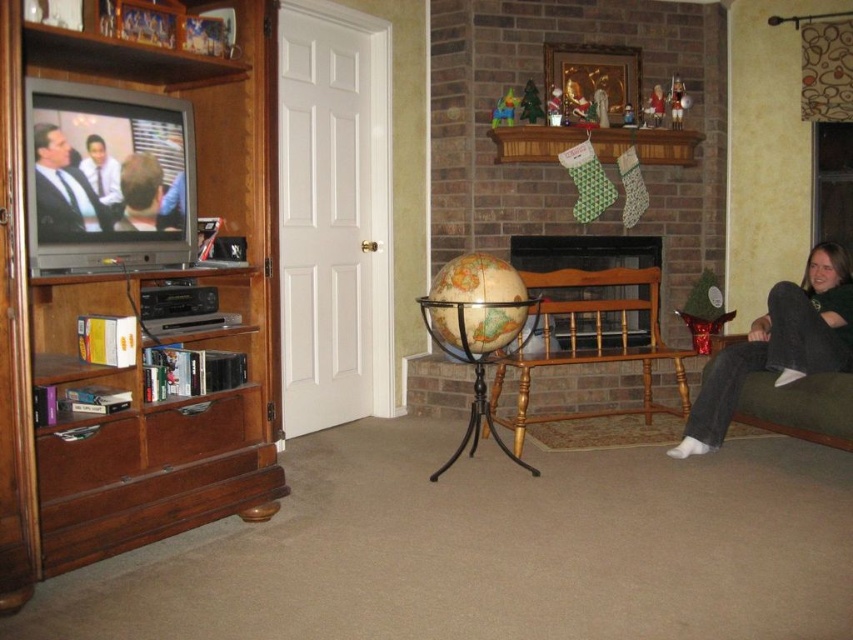
Does wooden bench at center have a smaller size compared to brick fireplace at center?

Actually, wooden bench at center might be larger than brick fireplace at center.

Which is below, wooden bench at center or brick fireplace at center?

wooden bench at center

Measure the distance between point (566, 278) and camera.

Point (566, 278) and camera are 4.11 meters apart.

Locate an element on the screen. This screenshot has height=640, width=853. wooden bench at center is located at coordinates (590, 340).

Does point (529, 362) come in front of point (93, 172)?

No, (529, 362) is further to viewer.

This screenshot has height=640, width=853. Find the location of `wooden bench at center`. wooden bench at center is located at coordinates (590, 340).

I want to click on wooden bench at center, so click(590, 340).

Is brown wood entertainment center at left further to camera compared to matte black suit at left?

No, brown wood entertainment center at left is in front of matte black suit at left.

Can you confirm if brown wood entertainment center at left is thinner than matte black suit at left?

Incorrect, brown wood entertainment center at left's width is not less than matte black suit at left's.

Does point (80, 529) lie in front of point (82, 209)?

Yes, point (80, 529) is in front of point (82, 209).

The width and height of the screenshot is (853, 640). I want to click on brown wood entertainment center at left, so click(x=129, y=308).